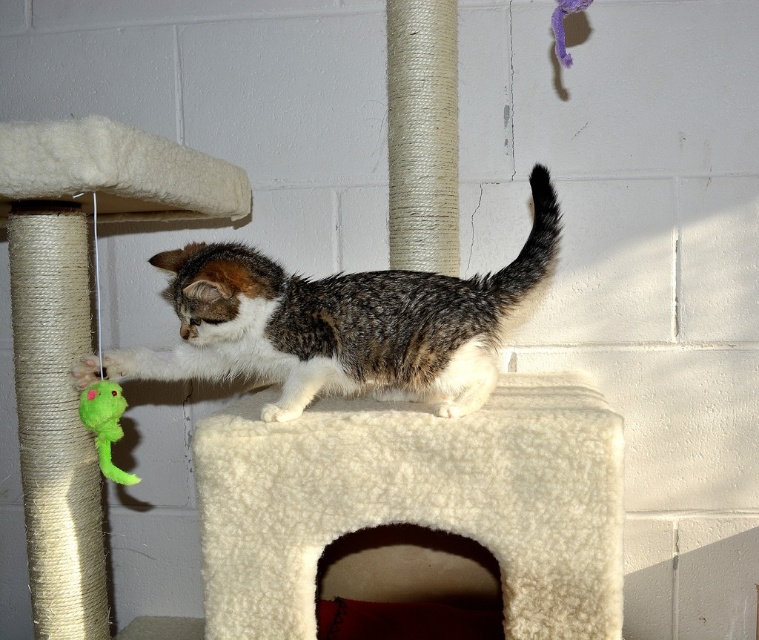
I want to click on calico fur cat at center, so click(339, 323).

Is point (241, 307) closer to camera compared to point (109, 467)?

That is True.

The image size is (759, 640). What are the coordinates of `calico fur cat at center` in the screenshot? It's located at (339, 323).

The height and width of the screenshot is (640, 759). I want to click on calico fur cat at center, so click(339, 323).

Does point (559, 429) come behind point (87, 401)?

No, it is in front of (87, 401).

Can you confirm if white fluffy cat bed at center is smaller than green plush toy at lower left?

No.

You are a GUI agent. You are given a task and a screenshot of the screen. Output one action in this format:
    pyautogui.click(x=<x>, y=<y>)
    Task: Click on the white fluffy cat bed at center
    The image size is (759, 640).
    Given the screenshot: What is the action you would take?
    pyautogui.click(x=416, y=500)

Does white fluffy cat bed at center have a lesser height compared to calico fur cat at center?

Yes, white fluffy cat bed at center is shorter than calico fur cat at center.

Does white fluffy cat bed at center appear on the right side of calico fur cat at center?

Indeed, white fluffy cat bed at center is positioned on the right side of calico fur cat at center.

Where is `white fluffy cat bed at center`? white fluffy cat bed at center is located at coordinates (416, 500).

Identify the location of white fluffy cat bed at center. Image resolution: width=759 pixels, height=640 pixels. (416, 500).